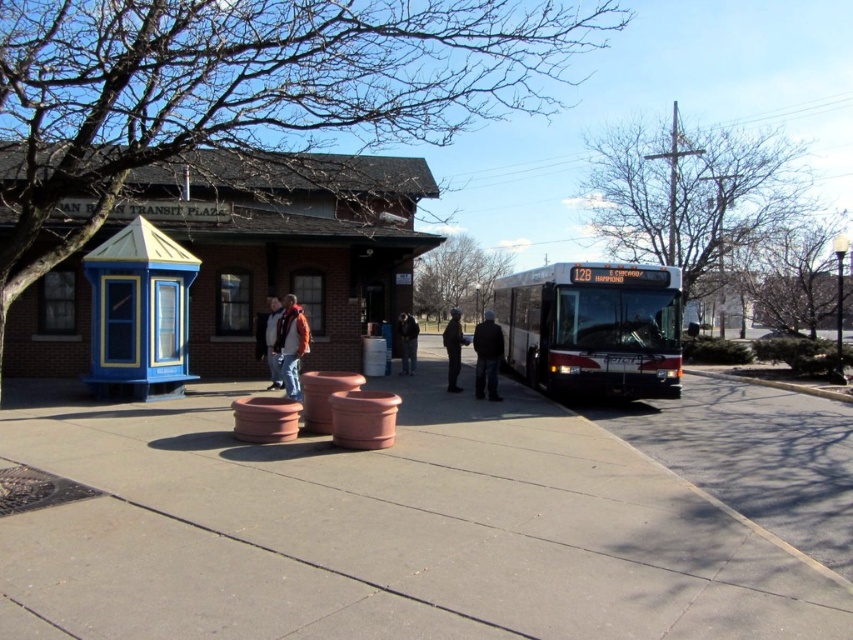
Measure the distance between black leather jacket at center and dark gray jacket at center.

1.81 meters

Can you confirm if black leather jacket at center is bigger than dark gray jacket at center?

Indeed, black leather jacket at center has a larger size compared to dark gray jacket at center.

In the scene shown: Who is more forward, (456, 330) or (405, 352)?

Point (456, 330) is in front.

Where is `black leather jacket at center`? This screenshot has width=853, height=640. black leather jacket at center is located at coordinates [453, 348].

Can you confirm if blue painted booth at left is shorter than dark gray jacket at center?

No.

Is blue painted booth at left below dark gray jacket at center?

Incorrect, blue painted booth at left is not positioned below dark gray jacket at center.

Image resolution: width=853 pixels, height=640 pixels. In order to click on blue painted booth at left in this screenshot , I will do `click(138, 314)`.

Does concrete at center come behind black leather jacket at center?

No, it is in front of black leather jacket at center.

Is point (73, 406) behind point (450, 381)?

That is False.

Does point (474, 609) come closer to viewer compared to point (445, 339)?

Yes, point (474, 609) is closer to viewer.

The width and height of the screenshot is (853, 640). Identify the location of concrete at center. (434, 518).